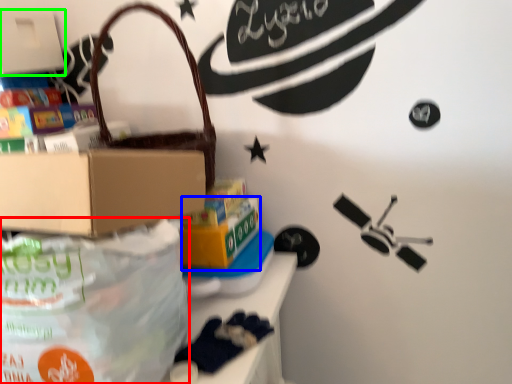
Question: Which object is positioned closest to diaper bag (highlighted by a red box)? Select from box (highlighted by a blue box) and box (highlighted by a green box).

Choices:
 (A) box
 (B) box

Answer: (A)